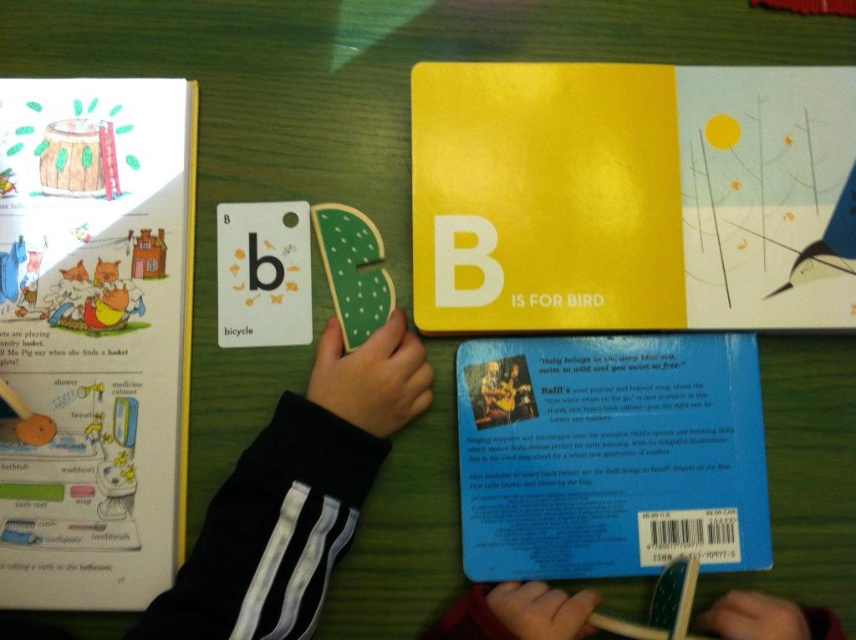
You are a child trying to place a toy that is 5 inches long between the yellow matte book at upper center and the blue matte book at center. Based on the scene, will the toy fit in the space between them?

The distance between the yellow matte book at upper center and the blue matte book at center is 4.78 inches. Since the toy is 5 inches long, it will not fit in the space between them as the space is slightly shorter than the toy.

You are a child sitting at the green wooden table. You want to reach for the point at coordinates point [651,195] and point [260,499]. Which point is closer to you?

Point [260,499] is closer to you because it is in front of point [651,195].

You are a teacher organizing a classroom. You have two books, the yellow matte book at upper center and the blue matte book at center. Which book should you place on top to ensure the one below is visible?

The blue matte book at center should be placed on top because the yellow matte book at upper center is currently positioned over it, meaning the blue one is underneath and would need to be on top to make the yellow one visible below.